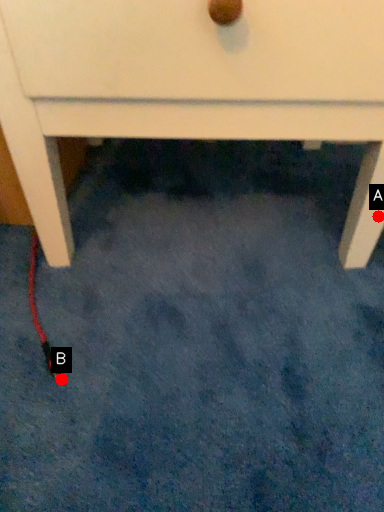
Question: Two points are circled on the image, labeled by A and B beside each circle. Which point is closer to the camera taking this photo?

Choices:
 (A) A is closer
 (B) B is closer

Answer: (B)